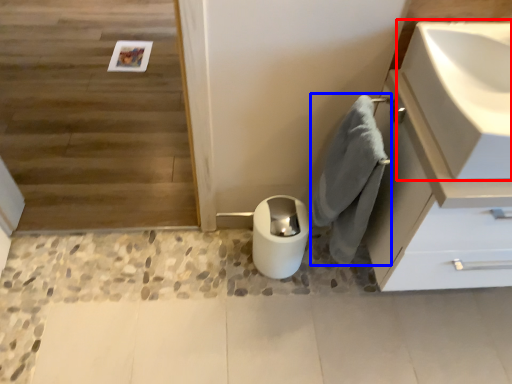
Question: Among these objects, which one is farthest to the camera, sink (highlighted by a red box) or bath towel (highlighted by a blue box)?

Choices:
 (A) sink
 (B) bath towel

Answer: (B)